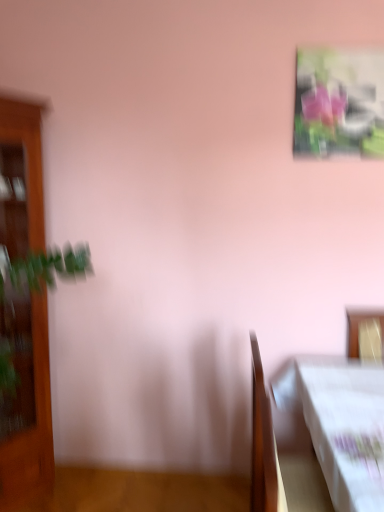
Question: Considering the relative sizes of wooden table at lower right and wooden cabinet at left in the image provided, is wooden table at lower right taller than wooden cabinet at left?

Choices:
 (A) no
 (B) yes

Answer: (A)

Question: Considering the relative sizes of wooden table at lower right and wooden cabinet at left in the image provided, is wooden table at lower right smaller than wooden cabinet at left?

Choices:
 (A) yes
 (B) no

Answer: (A)

Question: From the image's perspective, is wooden table at lower right above wooden cabinet at left?

Choices:
 (A) yes
 (B) no

Answer: (B)

Question: Is wooden table at lower right oriented away from wooden cabinet at left?

Choices:
 (A) no
 (B) yes

Answer: (A)

Question: Is wooden table at lower right thinner than wooden cabinet at left?

Choices:
 (A) yes
 (B) no

Answer: (A)

Question: Could you tell me if wooden table at lower right is facing wooden cabinet at left?

Choices:
 (A) yes
 (B) no

Answer: (B)

Question: Considering the relative positions of metallic glossy picture frame at upper right and wooden cabinet at left in the image provided, is metallic glossy picture frame at upper right to the left of wooden cabinet at left from the viewer's perspective?

Choices:
 (A) yes
 (B) no

Answer: (B)

Question: From a real-world perspective, is metallic glossy picture frame at upper right physically above wooden cabinet at left?

Choices:
 (A) yes
 (B) no

Answer: (A)

Question: Does metallic glossy picture frame at upper right lie behind wooden cabinet at left?

Choices:
 (A) no
 (B) yes

Answer: (B)

Question: Is wooden cabinet at left completely or partially inside metallic glossy picture frame at upper right?

Choices:
 (A) yes
 (B) no

Answer: (B)

Question: Can you confirm if metallic glossy picture frame at upper right is positioned to the right of wooden cabinet at left?

Choices:
 (A) no
 (B) yes

Answer: (B)

Question: Is metallic glossy picture frame at upper right taller than wooden cabinet at left?

Choices:
 (A) yes
 (B) no

Answer: (B)

Question: Can you confirm if wooden cabinet at left is wider than wooden table at lower right?

Choices:
 (A) no
 (B) yes

Answer: (B)